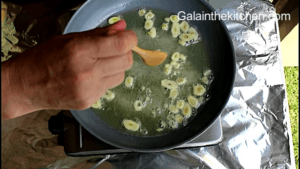
The width and height of the screenshot is (300, 169). I want to click on wooden spoon tan, so click(x=159, y=59).